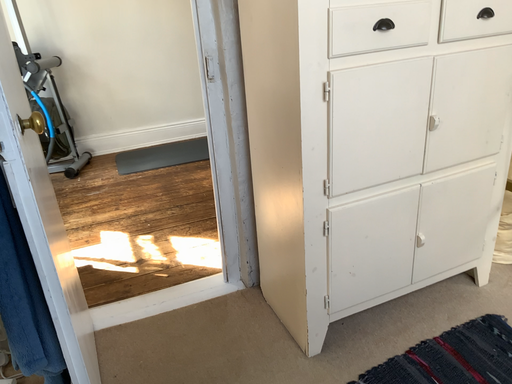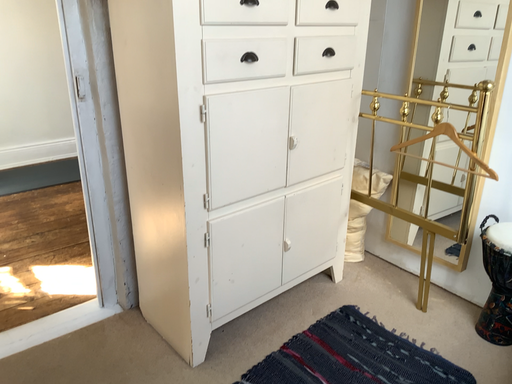
Question: Which way did the camera rotate in the video?

Choices:
 (A) rotated right
 (B) rotated left

Answer: (A)